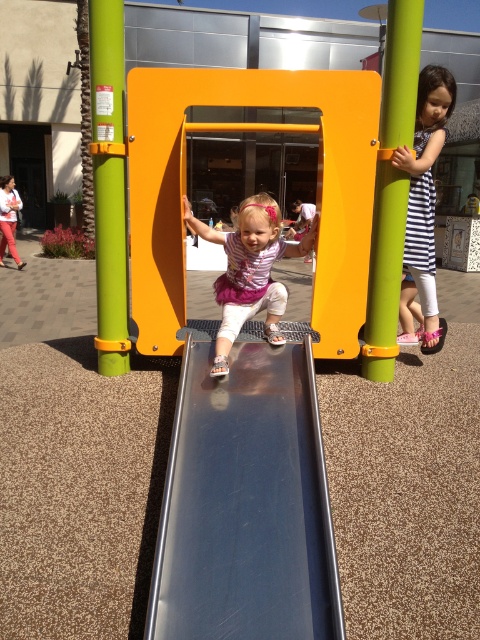
You are a parent at the playground. Your child is standing next to the metallic smooth slide at center and the matte pink dress at center. You want to ensure they can safely reach each other without stepping on the slide. What is the minimum distance they need to move to do so?

The metallic smooth slide at center and the matte pink dress at center are 73.85 centimeters apart. To reach each other without stepping on the slide, they need to move at least 73.85 centimeters towards each other.

You are a parent at the playground and see your child near the slide. You notice the metallic smooth slide at center and the matte pink dress at center. Which object is closer to you?

The metallic smooth slide at center is closer to you because it is in front of the matte pink dress at center.